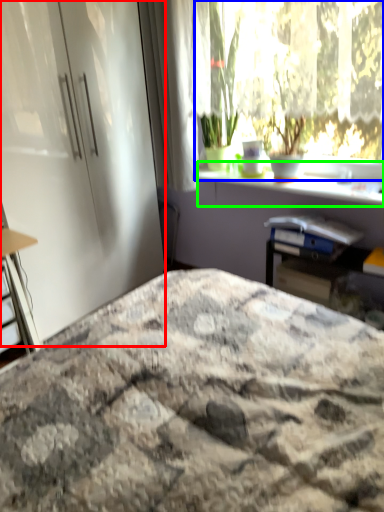
Question: Considering the real-world distances, which object is closest to screen door (highlighted by a red box)? window (highlighted by a blue box) or window sill (highlighted by a green box).

Choices:
 (A) window
 (B) window sill

Answer: (B)